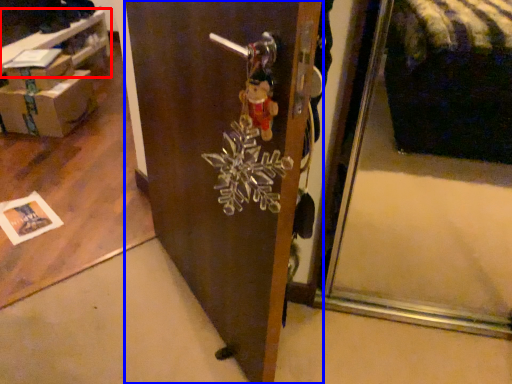
Question: Which object appears farthest to the camera in this image, table (highlighted by a red box) or door (highlighted by a blue box)?

Choices:
 (A) table
 (B) door

Answer: (A)